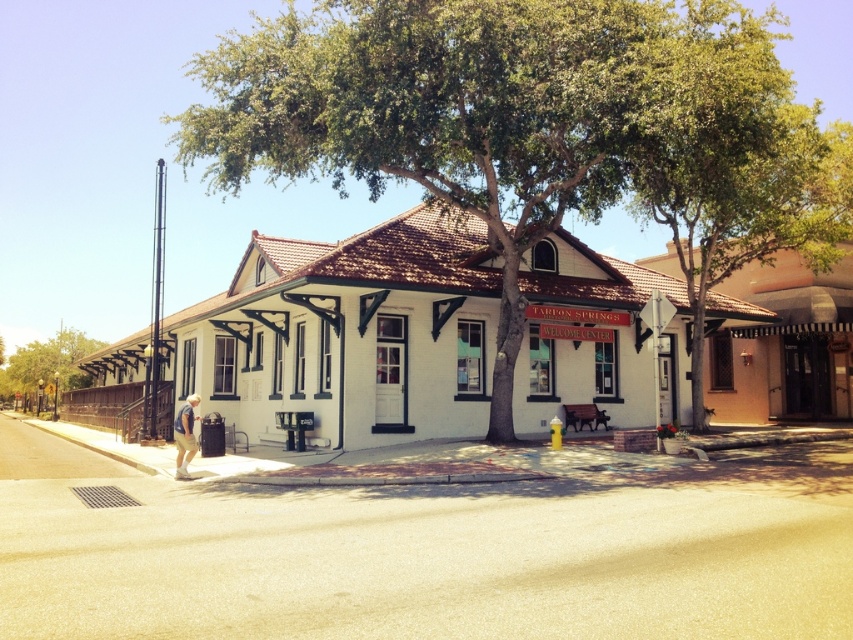
Can you confirm if white wood building at center is bigger than green leafy tree at lower left?

Indeed, white wood building at center has a larger size compared to green leafy tree at lower left.

Who is more distant from viewer, (277,310) or (44,342)?

The point (44,342) is behind.

The height and width of the screenshot is (640, 853). In order to click on white wood building at center in this screenshot , I will do `click(347, 333)`.

Is green leafy tree at center taller than white cotton shirt at lower left?

Indeed, green leafy tree at center has a greater height compared to white cotton shirt at lower left.

The image size is (853, 640). What do you see at coordinates (531, 128) in the screenshot? I see `green leafy tree at center` at bounding box center [531, 128].

In order to click on green leafy tree at center in this screenshot , I will do `click(531, 128)`.

Which is more to the left, green leafy tree at lower left or white cotton shirt at lower left?

Positioned to the left is green leafy tree at lower left.

Does point (38, 355) lie behind point (173, 436)?

Yes, point (38, 355) is behind point (173, 436).

Between point (33, 397) and point (195, 440), which one is positioned in front?

Point (195, 440) is more forward.

You are a GUI agent. You are given a task and a screenshot of the screen. Output one action in this format:
    pyautogui.click(x=<x>, y=<y>)
    Task: Click on the green leafy tree at lower left
    Image resolution: width=853 pixels, height=640 pixels.
    Given the screenshot: What is the action you would take?
    pyautogui.click(x=45, y=364)